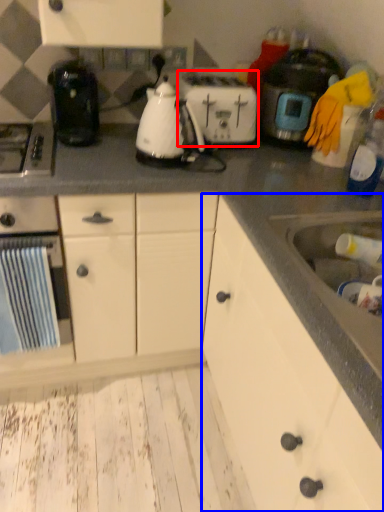
Question: Which point is further to the camera, toaster (highlighted by a red box) or cabinetry (highlighted by a blue box)?

Choices:
 (A) toaster
 (B) cabinetry

Answer: (A)